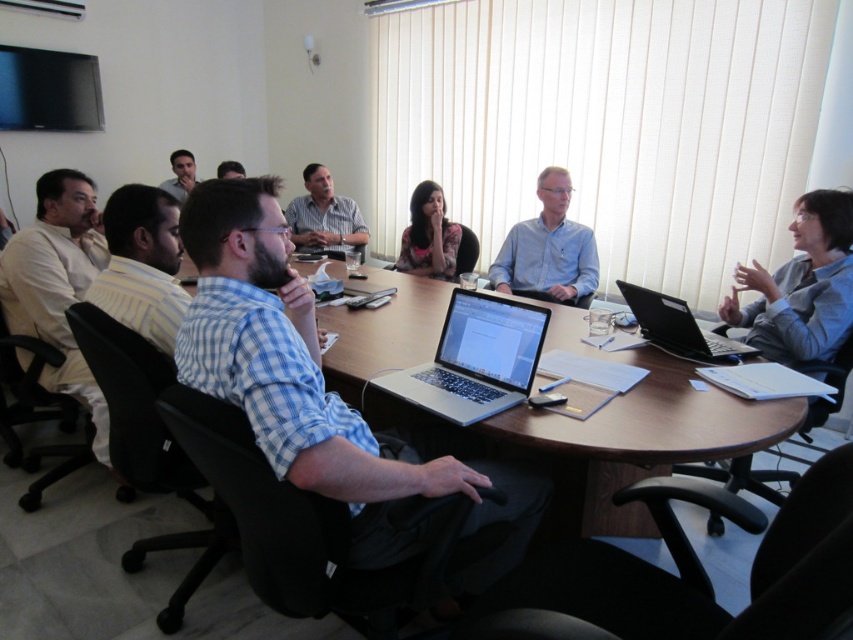
In the scene shown: You are attending a meeting in a conference room and need to place a document on the table. The document must be placed above the silver metallic laptop at center. Is there space available on the silver metallic round table at center for this?

The silver metallic round table at center is located below the silver metallic laptop at center, meaning there is space above the laptop on the table to place the document.

You are organizing a presentation and need to place a name tag on the table. The name tag is the same width as the floral shirt at center. Can you place the name tag to the right of the black matte laptop at right without overlapping?

The black matte laptop at right might be wider than the floral shirt at center, so the name tag may not fit to the right of the black matte laptop at right without overlapping. Check the actual width of the laptop first.